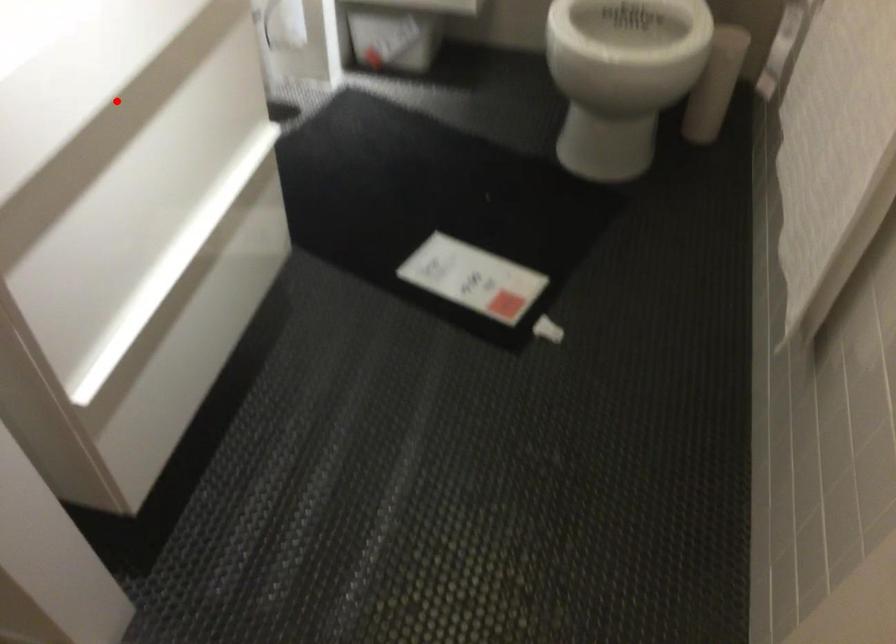
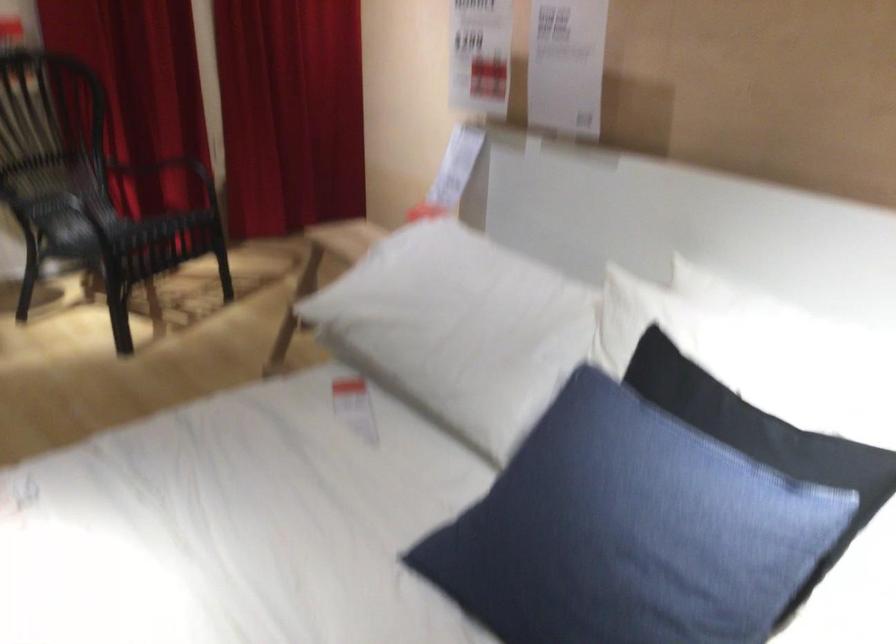
Question: I am providing you with two images of the same scene from different viewpoints. A red point is marked on the first image. Is the red point's position out of view in image 2?

Choices:
 (A) Yes
 (B) No

Answer: (A)